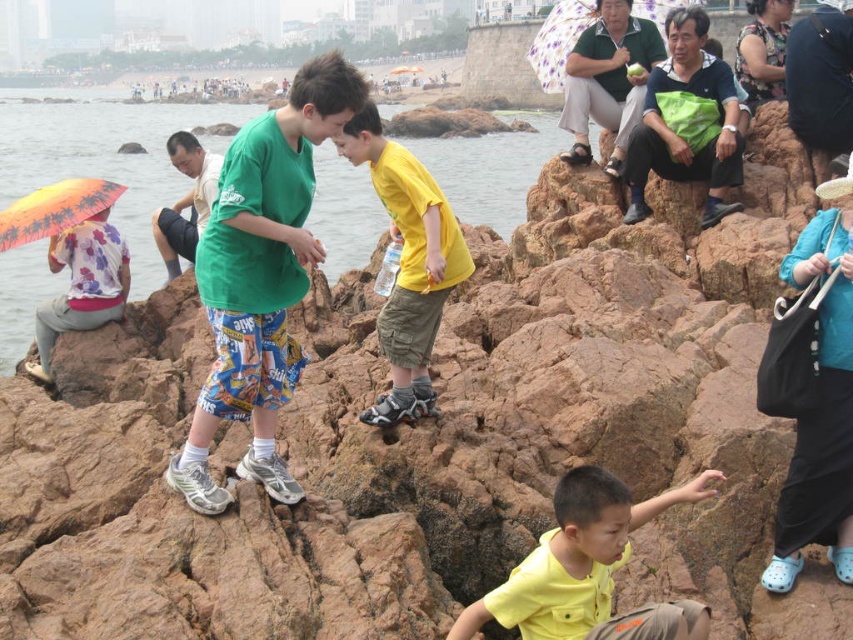
Question: Is yellow matte shirt at center smaller than floral fabric umbrella at upper center?

Choices:
 (A) no
 (B) yes

Answer: (B)

Question: Which point appears closest to the camera in this image?

Choices:
 (A) (409, 172)
 (B) (135, 168)
 (C) (80, 237)
 (D) (680, 4)

Answer: (A)

Question: Is yellow matte shorts at center thinner than orange fabric umbrella at left?

Choices:
 (A) yes
 (B) no

Answer: (A)

Question: Does yellow matte shirt at center come behind orange fabric umbrella at left?

Choices:
 (A) no
 (B) yes

Answer: (A)

Question: Estimate the real-world distances between objects in this image. Which object is closer to the yellow matte shorts at center?

Choices:
 (A) floral fabric umbrella at upper center
 (B) orange fabric umbrella at left

Answer: (B)

Question: Which of the following is the closest to the observer?

Choices:
 (A) (91, 193)
 (B) (125, 300)
 (C) (335, 170)

Answer: (A)